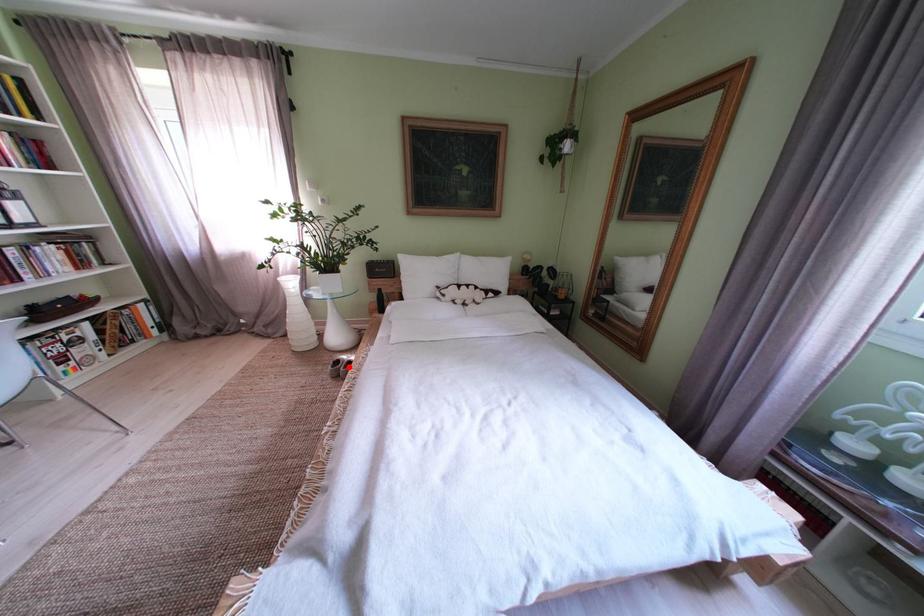
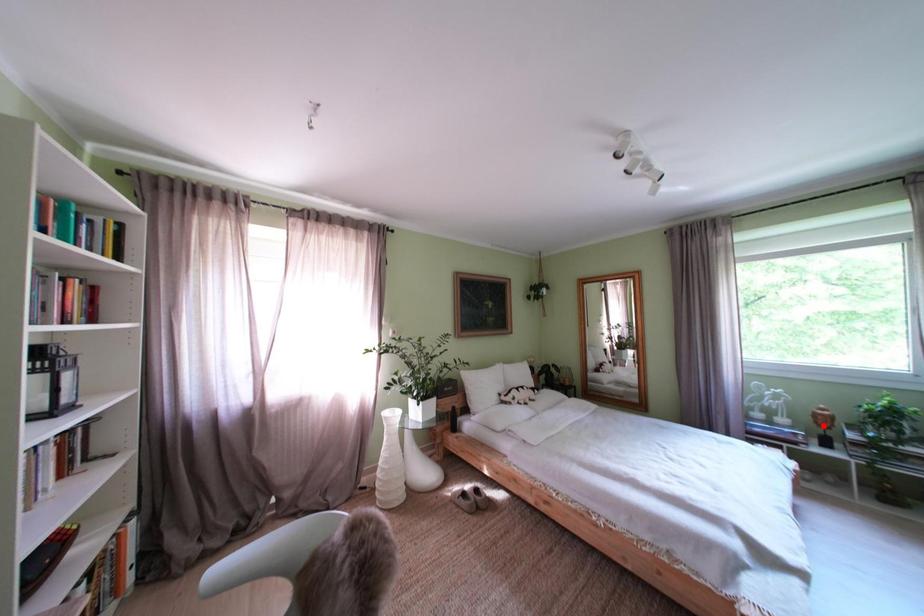
Consider the image. I am providing you with two images of the same scene from different viewpoints. A red point is marked on the first image and another point is marked on the second image. Are the points marked in image1 and image2 representing the same 3D position?

No